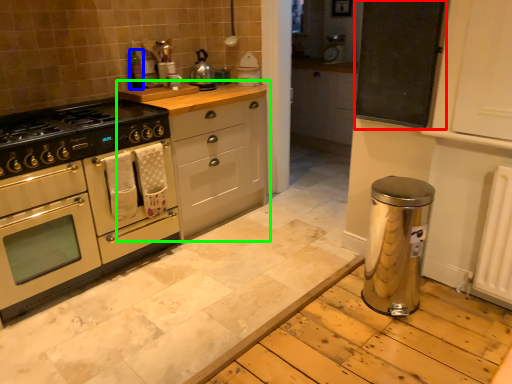
Question: Which object is positioned closest to bulletin board (highlighted by a red box)? Select from bottle (highlighted by a blue box) and cabinetry (highlighted by a green box).

Choices:
 (A) bottle
 (B) cabinetry

Answer: (B)